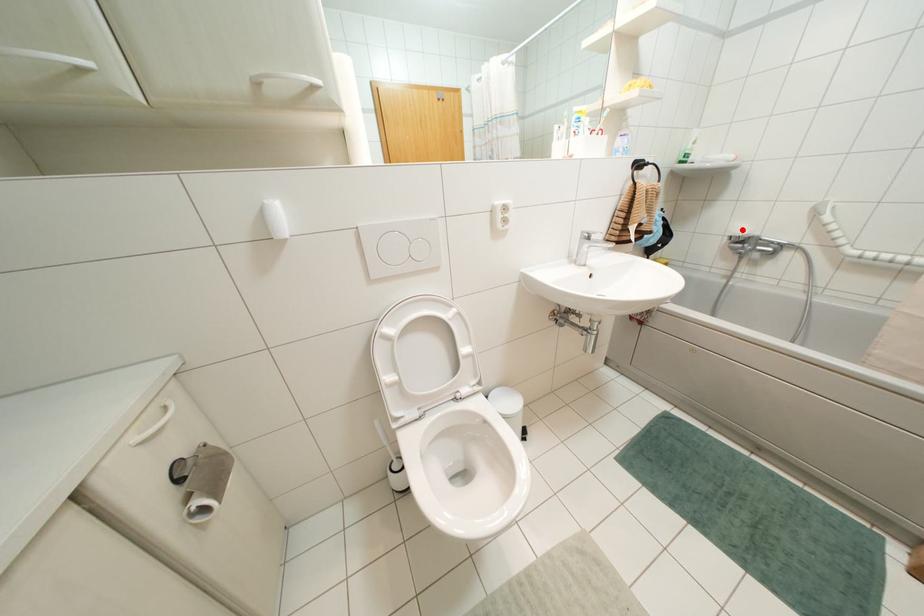
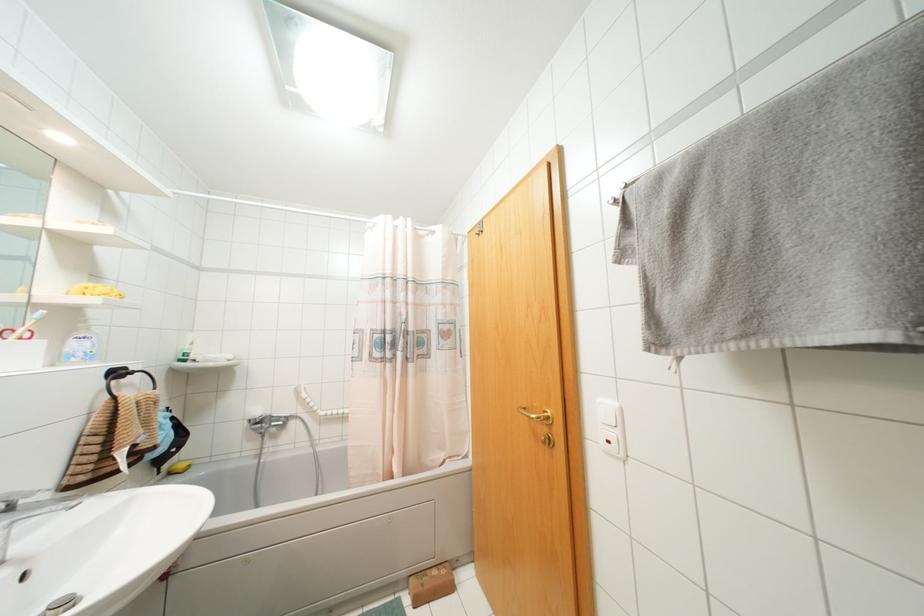
Find the pixel in the second image that matches the highlighted location in the first image.

(258, 411)